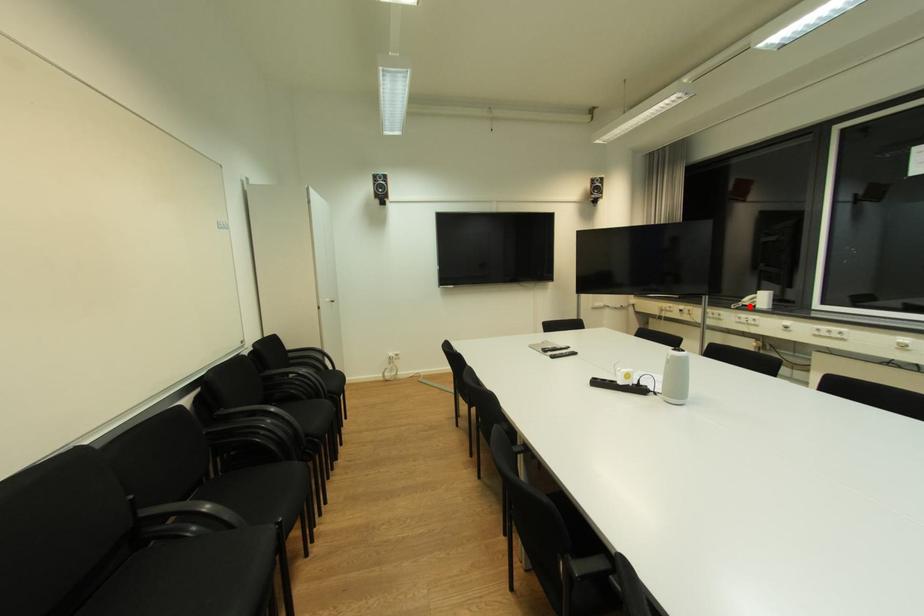
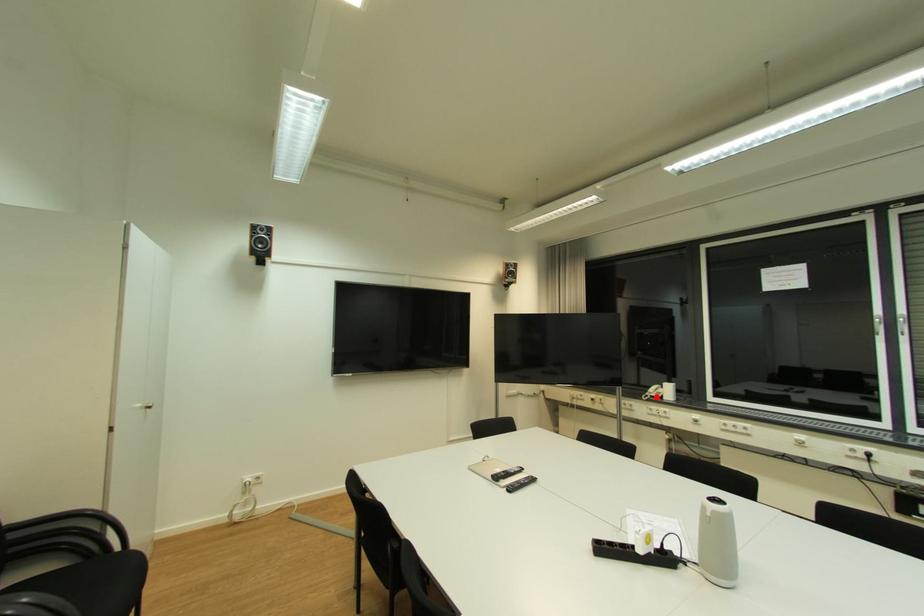
I am providing you with two images of the same scene from different viewpoints. A red point is marked on the first image and another point is marked on the second image. Does the point marked in image1 correspond to the same location as the one in image2?

Yes